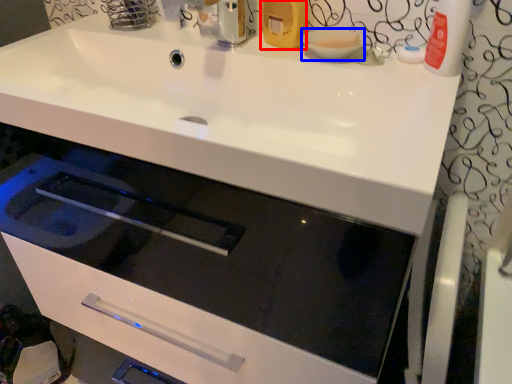
Question: Which object is further to the camera taking this photo, toiletry (highlighted by a red box) or basin (highlighted by a blue box)?

Choices:
 (A) toiletry
 (B) basin

Answer: (A)